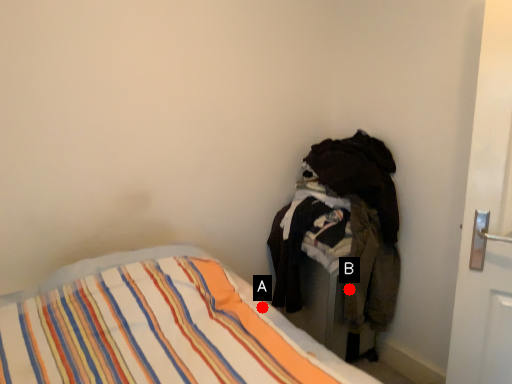
Question: Two points are circled on the image, labeled by A and B beside each circle. Which point is closer to the camera?

Choices:
 (A) A is closer
 (B) B is closer

Answer: (A)